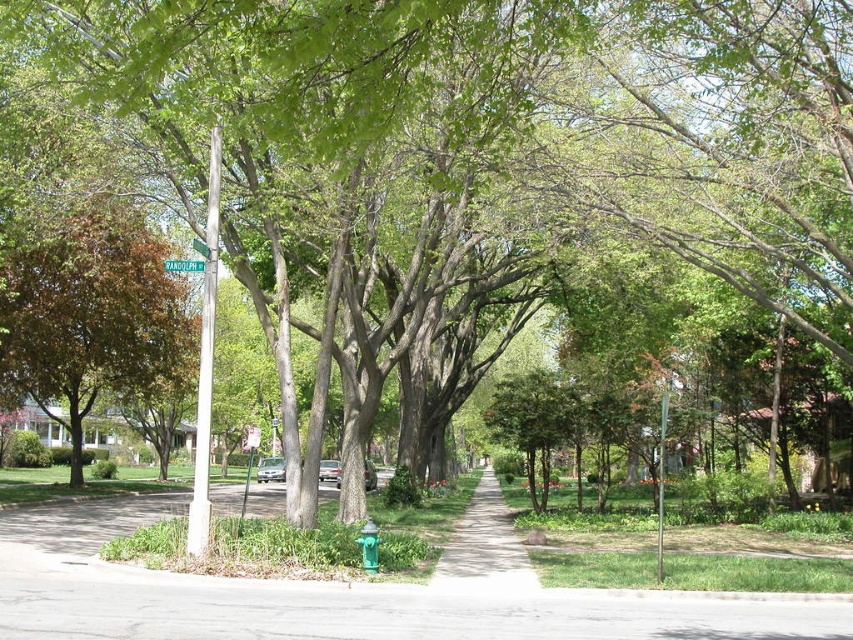
Can you confirm if concrete sidewalk at center is positioned to the left of green plastic street sign at upper center?

Incorrect, concrete sidewalk at center is not on the left side of green plastic street sign at upper center.

Does concrete sidewalk at center have a larger size compared to green plastic street sign at upper center?

Indeed, concrete sidewalk at center has a larger size compared to green plastic street sign at upper center.

I want to click on concrete sidewalk at center, so click(x=485, y=547).

Does gray asphalt pavement at center appear over green plastic street sign at upper center?

No.

Who is more distant from viewer, [491,531] or [198,269]?

Positioned behind is point [491,531].

The height and width of the screenshot is (640, 853). Identify the location of gray asphalt pavement at center. (354, 593).

Is gray asphalt pavement at center to the right of concrete sidewalk at center from the viewer's perspective?

In fact, gray asphalt pavement at center is to the left of concrete sidewalk at center.

Does point (33, 634) come behind point (498, 552)?

No, it is in front of (498, 552).

Identify the location of gray asphalt pavement at center. The image size is (853, 640). tap(354, 593).